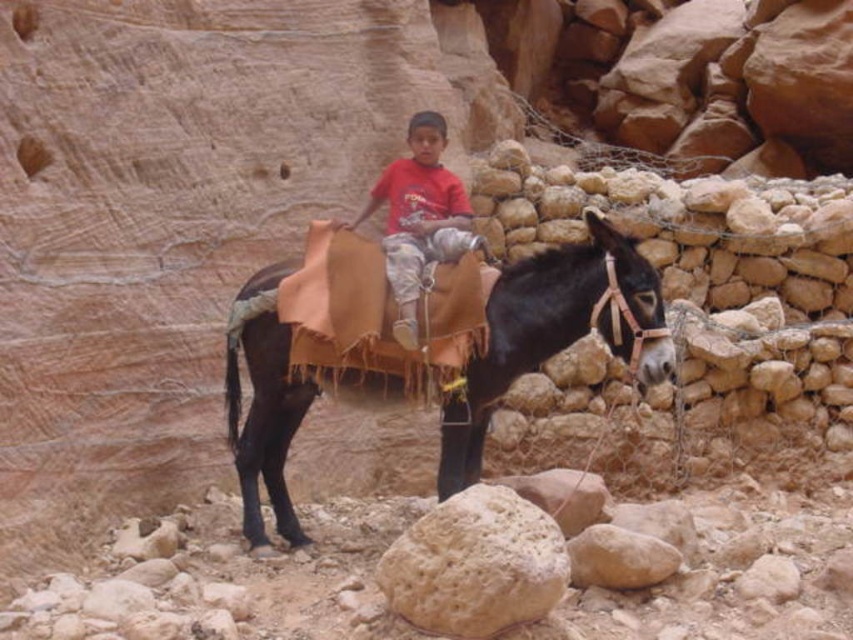
Does matte red shirt at center appear over smooth beige rock at center?

Correct, matte red shirt at center is located above smooth beige rock at center.

Between point (409, 160) and point (622, 560), which one is positioned behind?

The point (409, 160) is behind.

Find the location of a particular element. matte red shirt at center is located at coordinates (419, 218).

Is shiny brown saddle at center bigger than matte red shirt at center?

Yes, shiny brown saddle at center is bigger than matte red shirt at center.

Based on the photo, who is more distant from viewer, (x=450, y=452) or (x=462, y=211)?

Point (x=462, y=211)

Who is more distant from viewer, (659, 301) or (404, 332)?

The point (404, 332) is behind.

What are the coordinates of `shiny brown saddle at center` in the screenshot? It's located at (550, 332).

Who is positioned more to the right, smooth beige rock at lower center or matte red shirt at center?

smooth beige rock at lower center

Is smooth beige rock at lower center further to camera compared to matte red shirt at center?

No, smooth beige rock at lower center is in front of matte red shirt at center.

Consider the image. Who is more forward, (x=543, y=596) or (x=405, y=241)?

Point (x=543, y=596)

Where is `smooth beige rock at lower center`? Image resolution: width=853 pixels, height=640 pixels. smooth beige rock at lower center is located at coordinates (x=474, y=564).